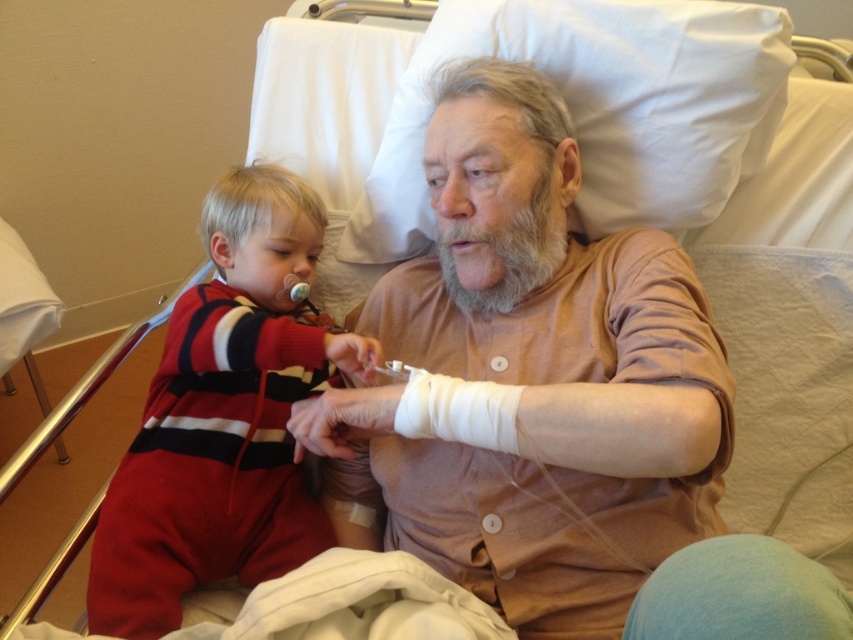
You are a nurse entering the room and need to check the vital signs of the person wearing the matte brown shirt at center and the red striped onesie at left. Which individual should you attend to first based on their proximity to the entrance?

You should attend to the matte brown shirt at center first since it is closer to you than the red striped onesie at left, which is further away.